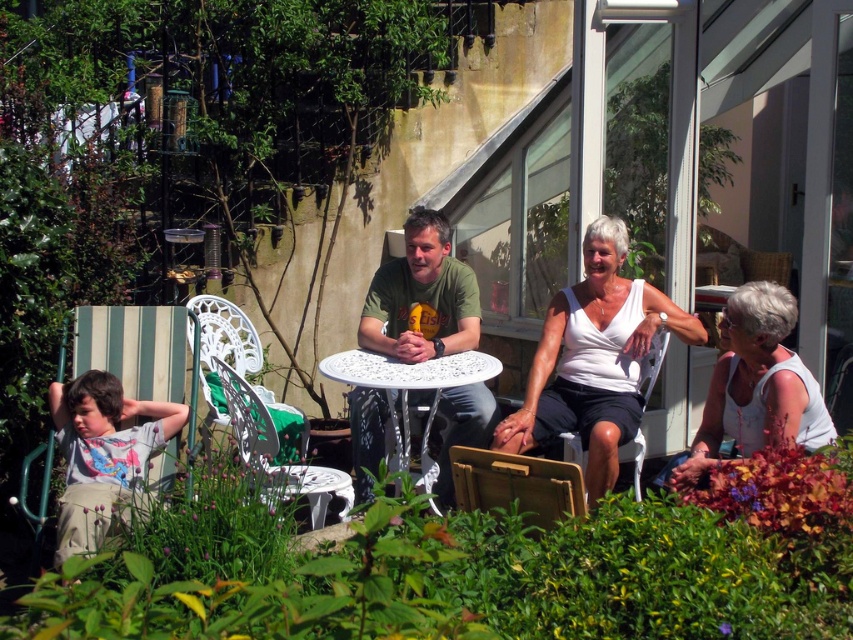
You are standing in the garden and want to move from the white metal table at center to the white textured chair at center. Which direction should you face to walk towards the chair?

Since the white textured chair at center is further to the viewer than the white metal table at center, you should face towards yourself to walk towards the chair.